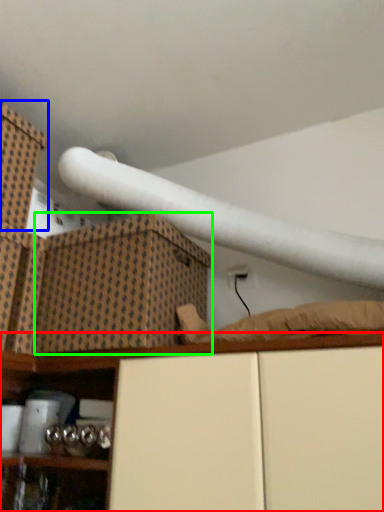
Question: Which is nearer to the shelf (highlighted by a red box)? box (highlighted by a blue box) or cardboard box (highlighted by a green box).

Choices:
 (A) box
 (B) cardboard box

Answer: (B)